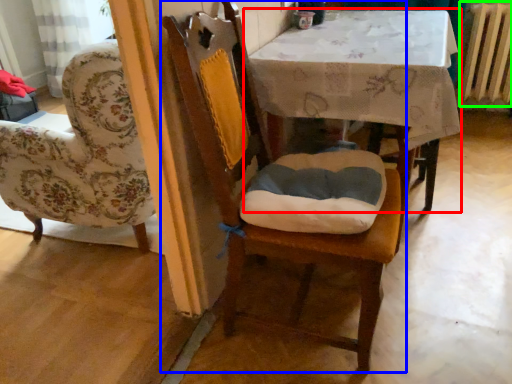
Question: Which object is the closest to the table (highlighted by a red box)? Choose among these: chair (highlighted by a blue box) or radiator (highlighted by a green box).

Choices:
 (A) chair
 (B) radiator

Answer: (A)